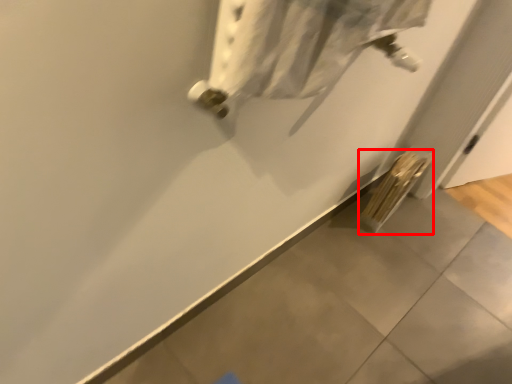
Question: From the image's perspective, what is the correct spatial positioning of radiator (annotated by the red box) in reference to wide?

Choices:
 (A) below
 (B) above

Answer: (A)